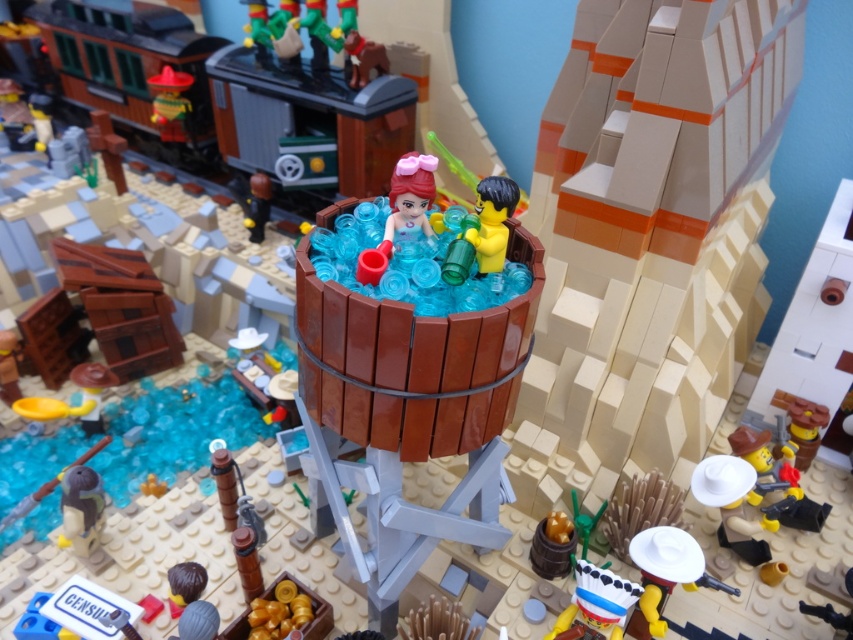
You are a delivery robot with a 20 cm wide package that needs to be placed between the wooden barrel at center and the yellow matte minifigure at center. Can you fit the package in the space between them?

The wooden barrel at center is 30.94 centimeters away from the yellow matte minifigure at center. Since the package is 20 cm wide, there is enough space between them to fit the package.

You are a LEGO figure trying to reach the translucent pink plastic figure at center. There is a matte black train car at upper left in your way. Can you walk directly underneath it to reach your destination?

The matte black train car at upper left is positioned over the translucent pink plastic figure at center, so yes, you can walk directly underneath it to reach the translucent pink plastic figure at center.